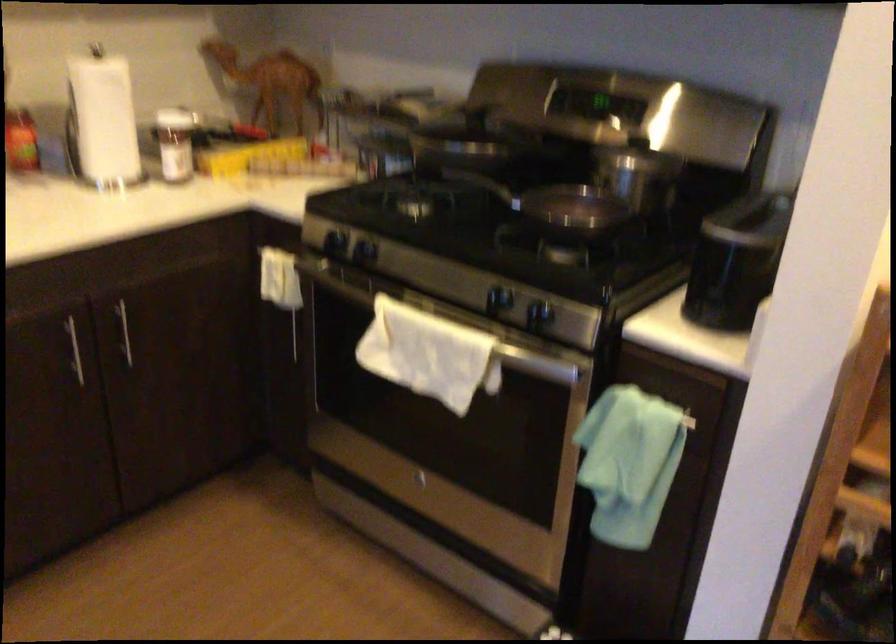
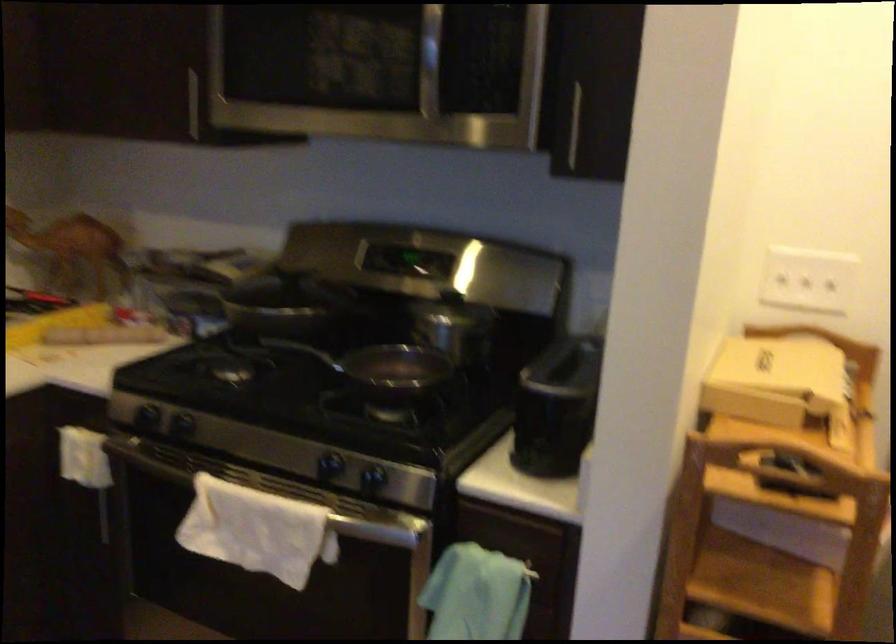
Question: The images are taken continuously from a first-person perspective. In which direction is your viewpoint rotating?

Choices:
 (A) Left
 (B) Right
 (C) Up
 (D) Down

Answer: (B)